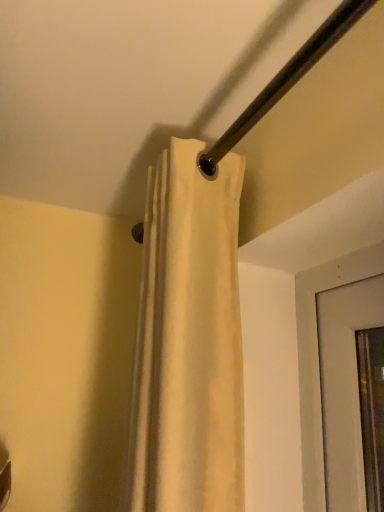
This screenshot has width=384, height=512. Describe the element at coordinates (286, 80) in the screenshot. I see `matte metal towel bar at upper center` at that location.

You are a GUI agent. You are given a task and a screenshot of the screen. Output one action in this format:
    pyautogui.click(x=<x>, y=<y>)
    Task: Click on the matte metal towel bar at upper center
    Image resolution: width=384 pixels, height=512 pixels.
    Given the screenshot: What is the action you would take?
    pyautogui.click(x=286, y=80)

What are the coordinates of `matte metal towel bar at upper center` in the screenshot? It's located at (286, 80).